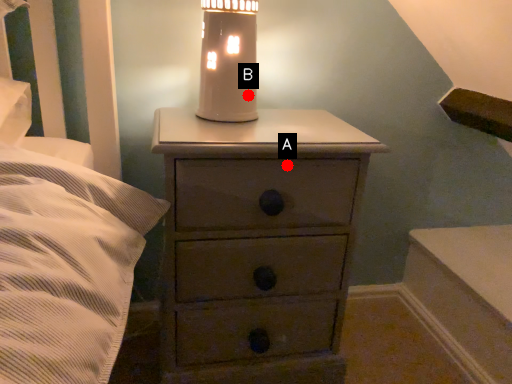
Question: Two points are circled on the image, labeled by A and B beside each circle. Which point is closer to the camera taking this photo?

Choices:
 (A) A is closer
 (B) B is closer

Answer: (A)